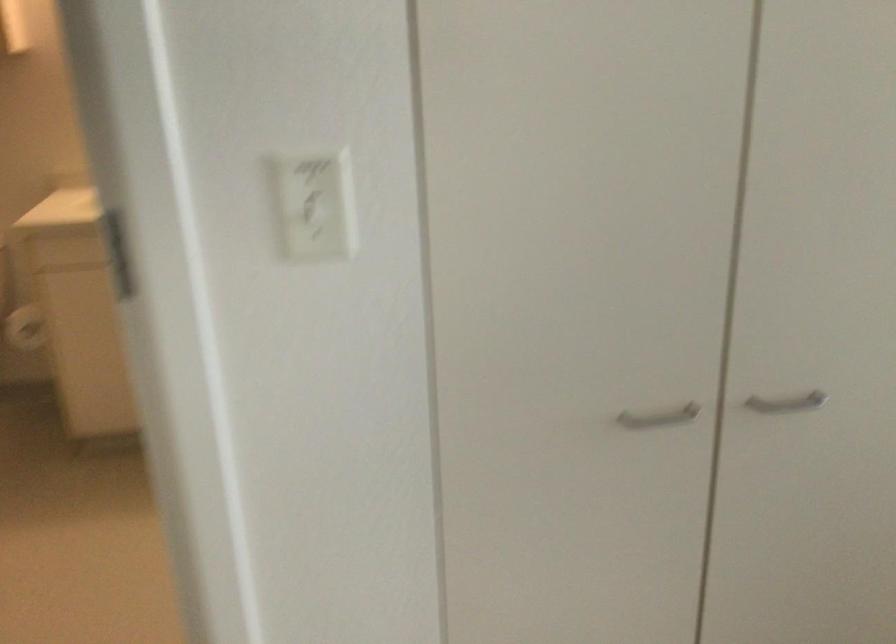
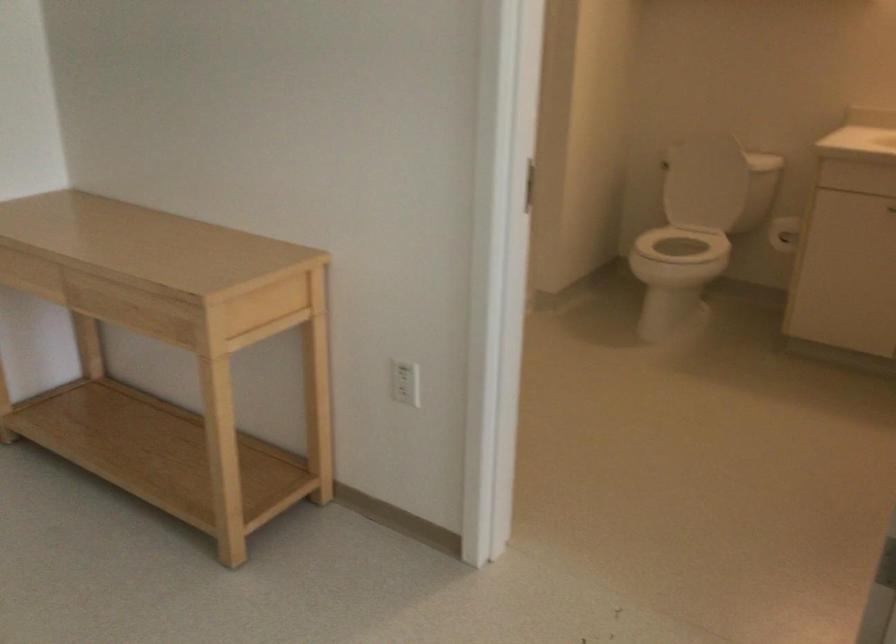
Question: The camera is either moving clockwise (left) or counter-clockwise (right) around the object. The first image is from the beginning of the video and the second image is from the end. Is the camera moving left or right when shooting the video?

Choices:
 (A) Left
 (B) Right

Answer: (B)